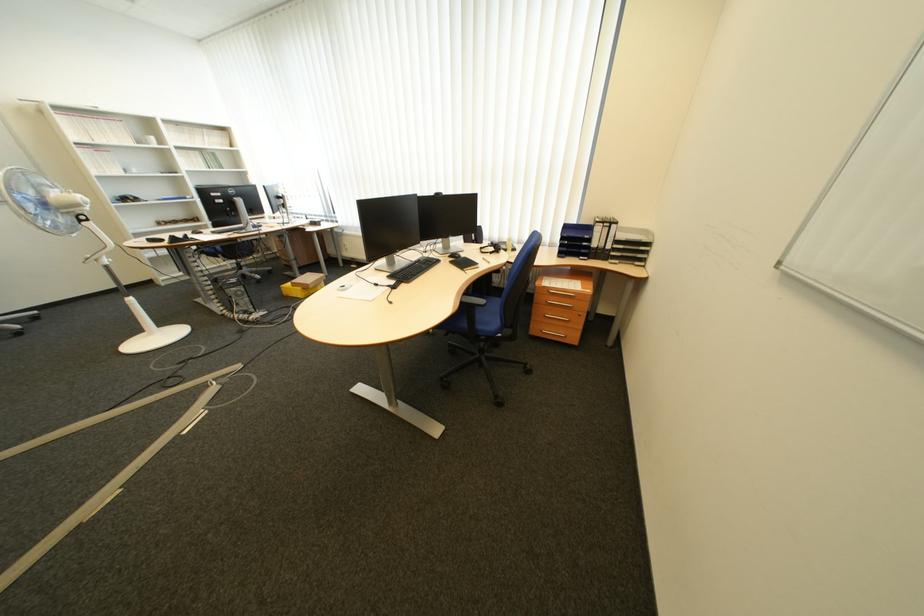
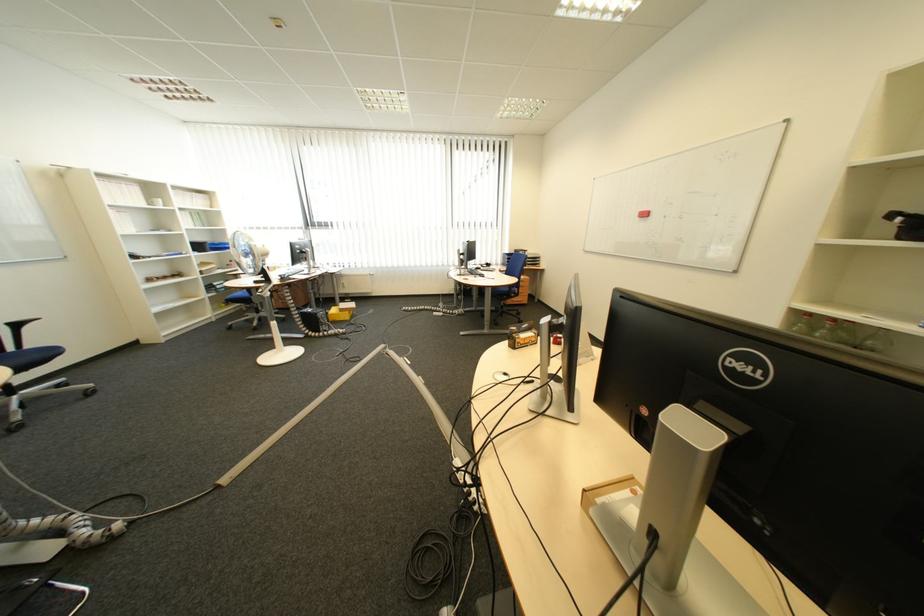
Question: I am providing you with two images of the same scene from different viewpoints. Please identify which objects are invisible in image2.

Choices:
 (A) yellow cardboard box
 (B) black headphones
 (C) yellow object
 (D) small cardboard box

Answer: (B)